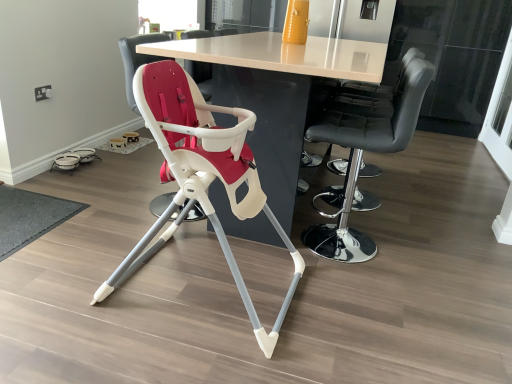
Locate an element on the screen. vacant space underneath matte plastic highchair at center, positioned as the 2th chair in right-to-left order (from a real-world perspective) is located at coordinates (209, 285).